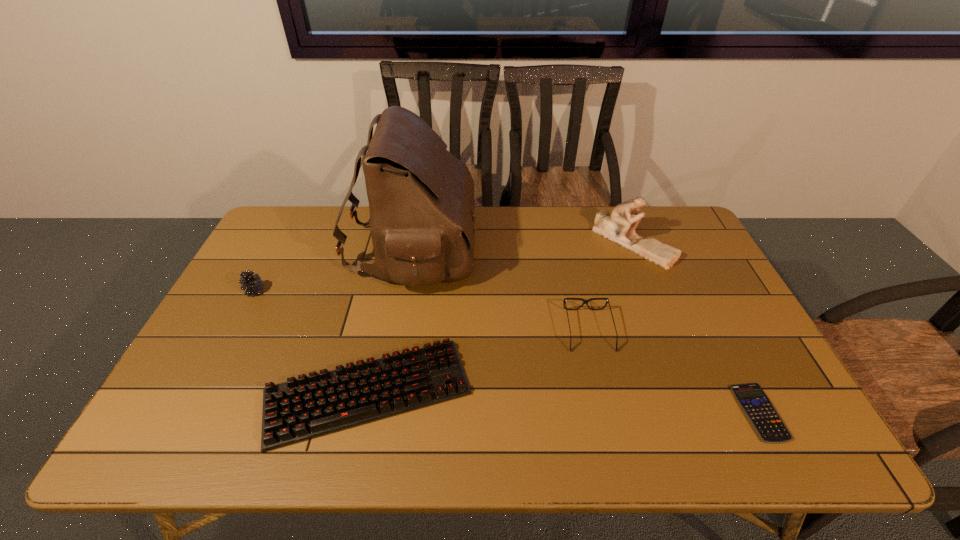
You are a GUI agent. You are given a task and a screenshot of the screen. Output one action in this format:
    pyautogui.click(x=<x>, y=<y>)
    Task: Click on the satchel
    The image size is (960, 540).
    Given the screenshot: What is the action you would take?
    pyautogui.click(x=421, y=199)

The height and width of the screenshot is (540, 960). Find the location of `figurine`. figurine is located at coordinates (619, 227).

Image resolution: width=960 pixels, height=540 pixels. Identify the location of the fourth shortest object. point(253,284).

You are a GUI agent. You are given a task and a screenshot of the screen. Output one action in this format:
    pyautogui.click(x=<x>, y=<y>)
    Task: Click on the leftmost object
    
    Given the screenshot: What is the action you would take?
    pyautogui.click(x=253, y=284)

Locate an element on the screen. the fourth tallest object is located at coordinates (565, 299).

You are a GUI agent. You are given a task and a screenshot of the screen. Output one action in this format:
    pyautogui.click(x=<x>, y=<y>)
    Task: Click on the fourth object from left to right
    The height and width of the screenshot is (540, 960).
    Given the screenshot: What is the action you would take?
    pyautogui.click(x=565, y=299)

At what (x,y) coordinates should I click in order to perform the action: click on the second shortest object. Please return your answer as a coordinate pair (x, y). The image size is (960, 540). Looking at the image, I should click on (300, 409).

Find the location of `calculator`. calculator is located at coordinates (759, 410).

Identify the location of vacant region located 0.070m on the front flap of the tallest object. 497,248.

You are a GUI agent. You are given a task and a screenshot of the screen. Output one action in this format:
    pyautogui.click(x=<x>, y=<y>)
    Task: Click on the free location located 0.350m on the front-facing side of the figurine
    The width and height of the screenshot is (960, 540).
    Given the screenshot: What is the action you would take?
    pyautogui.click(x=682, y=362)